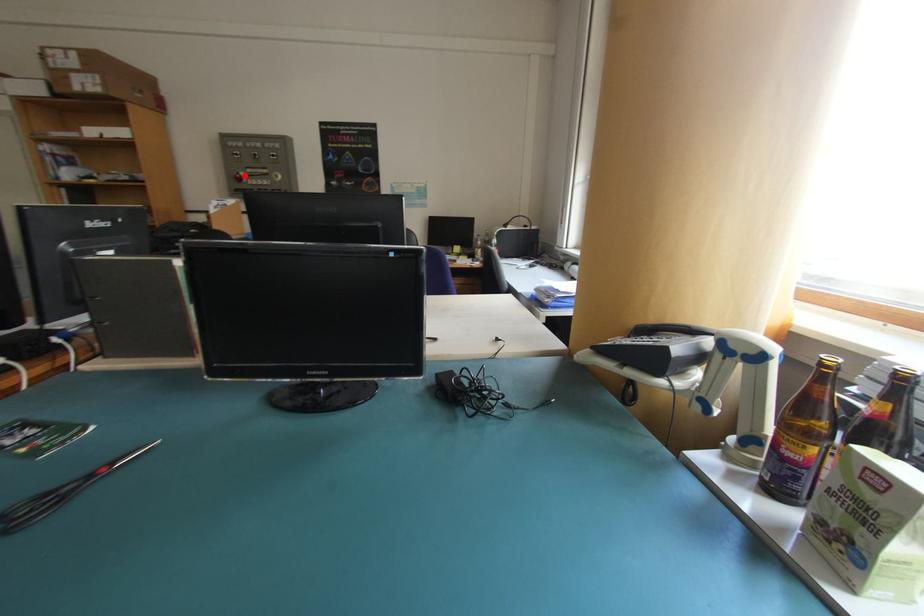
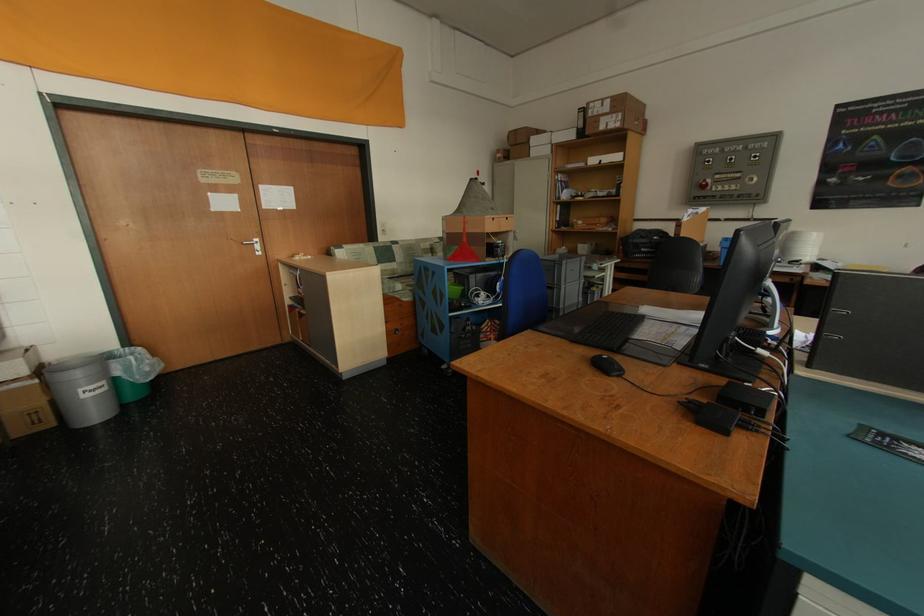
The point at the highlighted location is marked in the first image. Where is the corresponding point in the second image?

(709, 183)